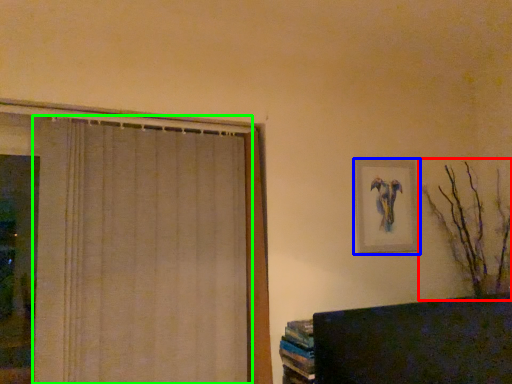
Question: Which is farther away from branch (highlighted by a red box)? picture frame (highlighted by a blue box) or curtain (highlighted by a green box)?

Choices:
 (A) picture frame
 (B) curtain

Answer: (B)